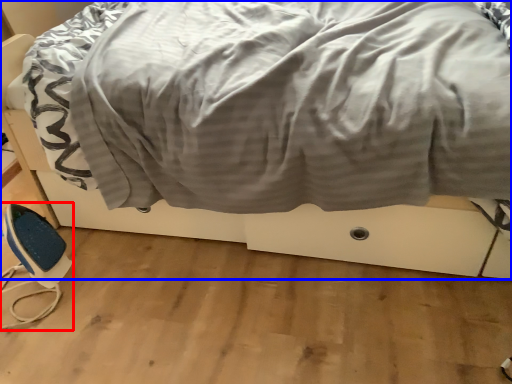
Question: Which of the following is the closest to the observer, equipment (highlighted by a red box) or bed (highlighted by a blue box)?

Choices:
 (A) equipment
 (B) bed

Answer: (B)